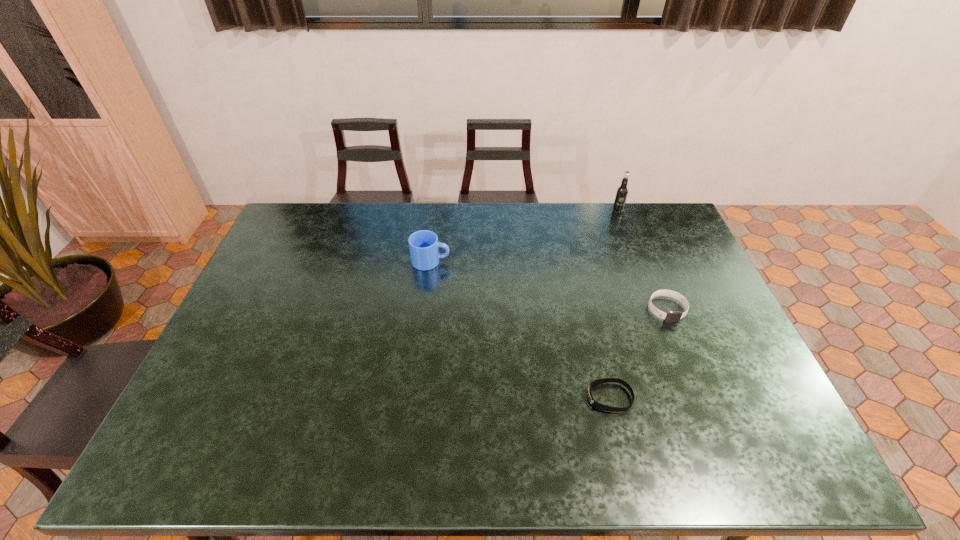
In the image, there is a desktop. At what (x,y) coordinates should I click in order to perform the action: click on vacant area at the far right corner. Please return your answer as a coordinate pair (x, y). This screenshot has height=540, width=960. Looking at the image, I should click on (630, 204).

Identify the location of free space between the second object from left to right and the farthest object. (613, 303).

Locate an element on the screen. This screenshot has height=540, width=960. vacant area that lies between the third object from right to left and the tallest object is located at coordinates (613, 303).

This screenshot has height=540, width=960. Find the location of `empty space between the right wristband and the left wristband`. empty space between the right wristband and the left wristband is located at coordinates click(638, 353).

Identify the location of vacant point located between the left wristband and the right wristband. (638, 353).

This screenshot has width=960, height=540. I want to click on free point between the shortest object and the farthest object, so click(x=613, y=303).

This screenshot has height=540, width=960. In order to click on free spot between the second shortest object and the nearer wristband in this screenshot , I will do (638, 353).

Locate an element on the screen. vacant region between the third object from right to left and the tallest object is located at coordinates (613, 303).

Where is `free point between the farthest object and the nearest object`? The image size is (960, 540). free point between the farthest object and the nearest object is located at coordinates (613, 303).

Identify the location of vacant space that's between the left wristband and the farthest object. (613, 303).